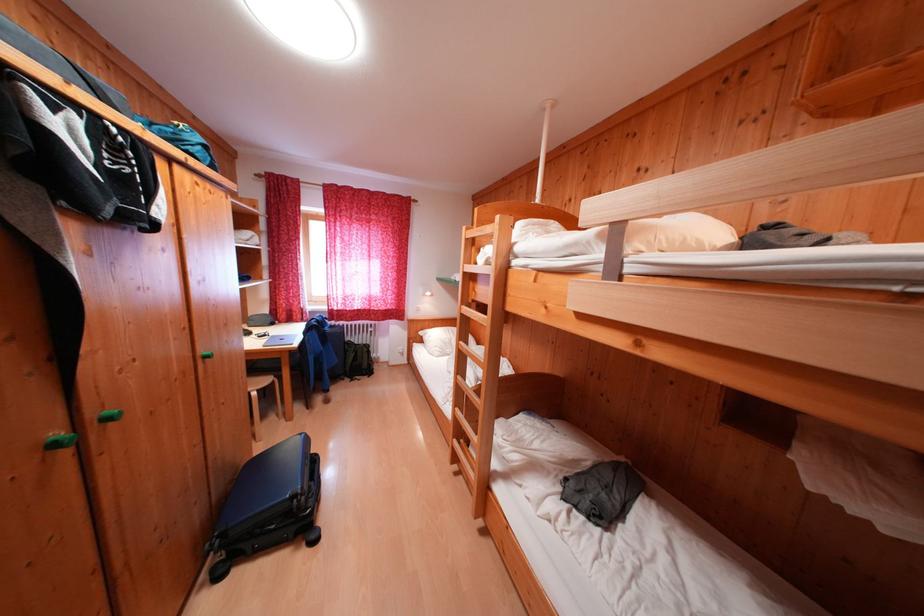
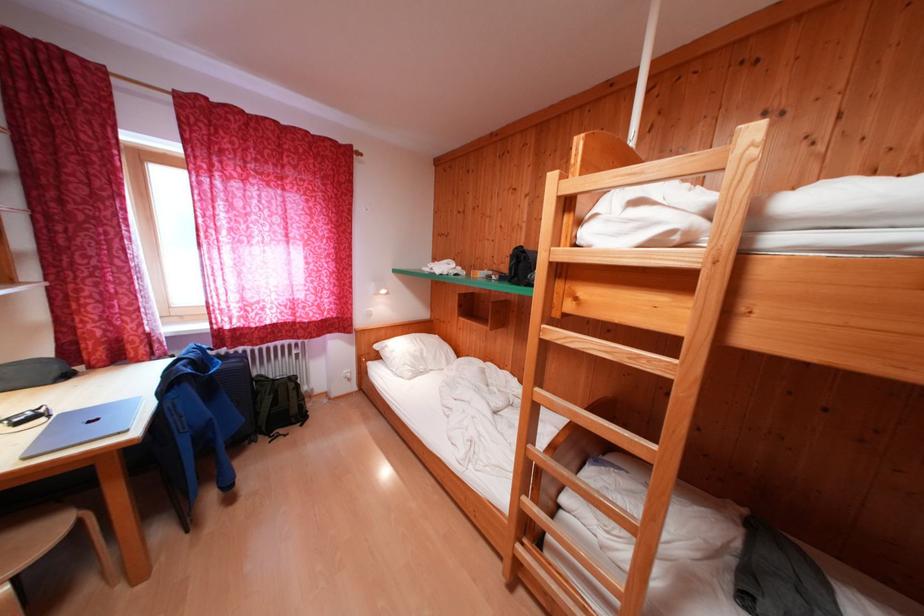
Where in the second image is the point corresponding to (274,384) from the first image?

(55, 538)